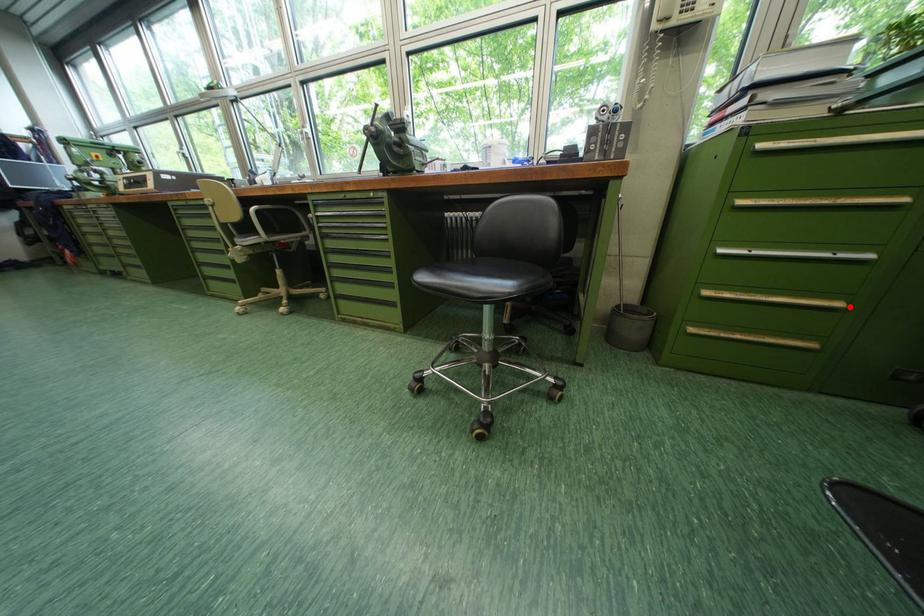
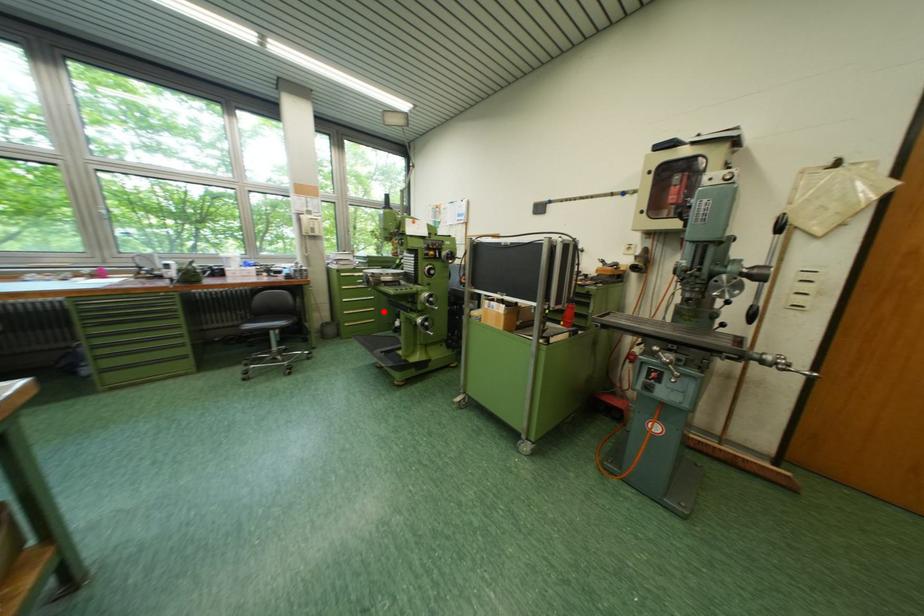
I am providing you with two images of the same scene from different viewpoints. A red point is marked on the first image and another point is marked on the second image. Does the point marked in image1 correspond to the same location as the one in image2?

Yes